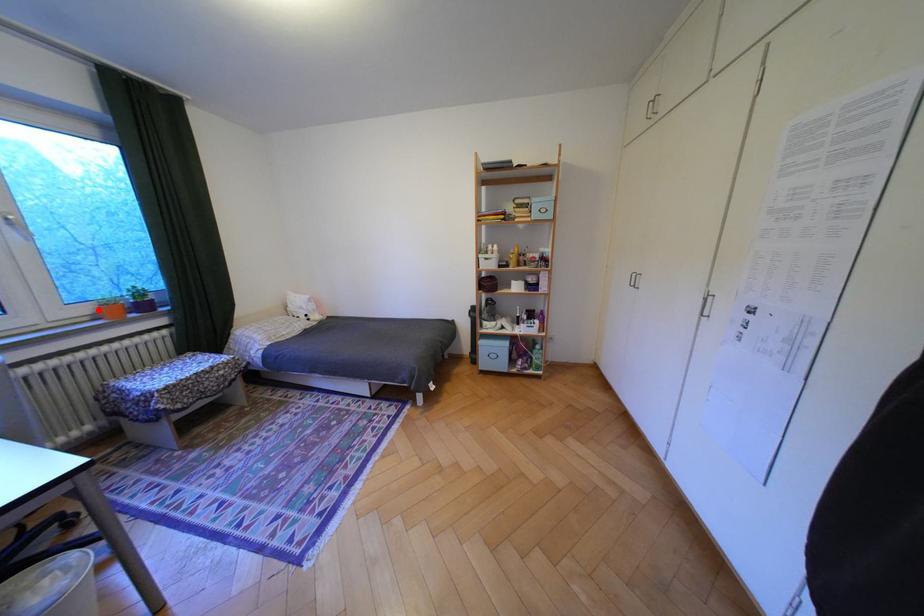
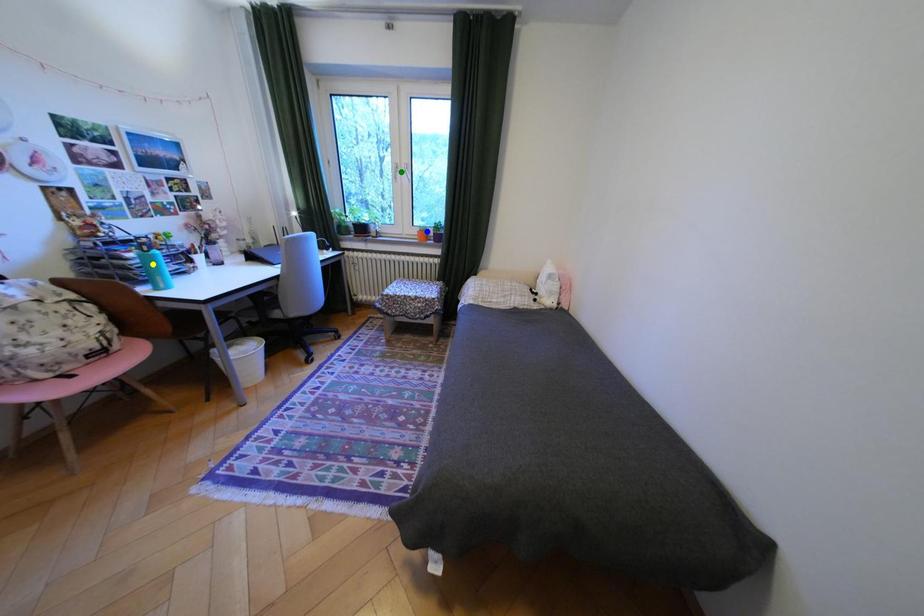
Question: I am providing you with two images of the same scene from different viewpoints. A red point is marked on the first image. You are given multiple points on the second image. Which spot in image 2 lines up with the point in image 1?

Choices:
 (A) green point
 (B) blue point
 (C) yellow point

Answer: (B)